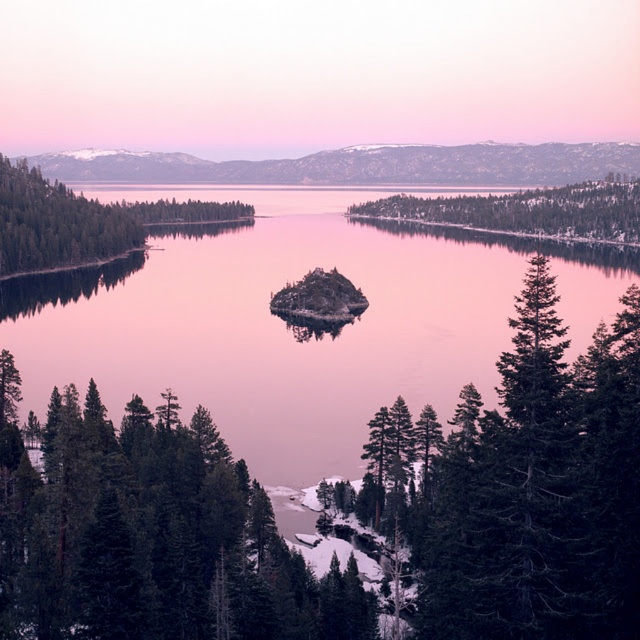
Looking at this image, is clear water at center positioned behind green matte island at center?

No, it is in front of green matte island at center.

Can you confirm if clear water at center is positioned to the right of green matte island at center?

No, clear water at center is not to the right of green matte island at center.

Between point (122, 342) and point (406, 214), which one is positioned in front?

Point (122, 342) is more forward.

The image size is (640, 640). What are the coordinates of `clear water at center` in the screenshot? It's located at (273, 326).

Between clear water at center and green matte tree at left, which one appears on the left side from the viewer's perspective?

green matte tree at left is more to the left.

Which is in front, point (298, 500) or point (44, 236)?

Positioned in front is point (298, 500).

The image size is (640, 640). What do you see at coordinates (273, 326) in the screenshot? I see `clear water at center` at bounding box center [273, 326].

This screenshot has height=640, width=640. Identify the location of clear water at center. (273, 326).

Does point (568, 189) come in front of point (84, 259)?

No, (568, 189) is further to viewer.

Based on the photo, can you confirm if green matte island at center is taller than green matte tree at left?

No, green matte island at center is not taller than green matte tree at left.

Locate an element on the screen. This screenshot has width=640, height=640. green matte island at center is located at coordinates (528, 211).